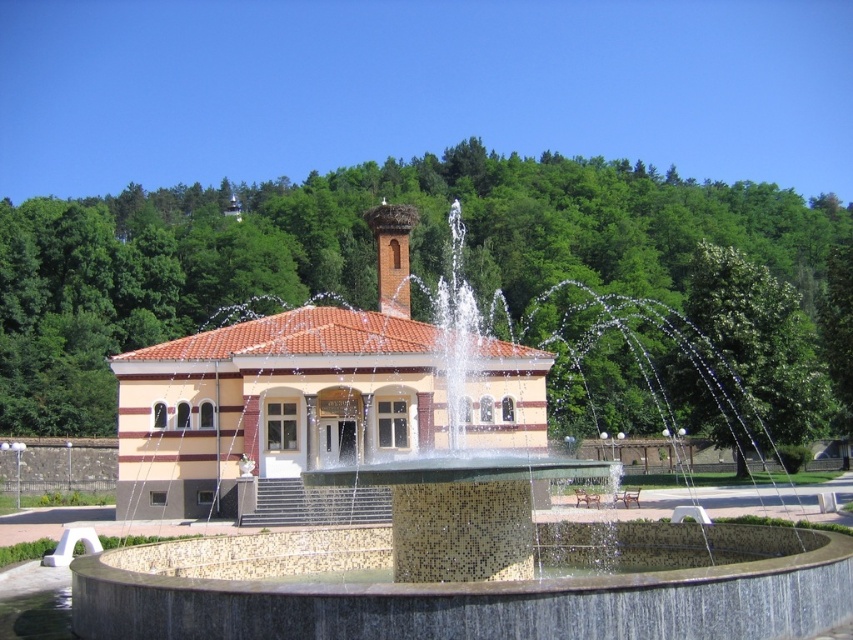
Question: Which object is the closest to the mosaic tiled fountain at center?

Choices:
 (A) yellow brick building at center
 (B) brick chimney at center

Answer: (A)

Question: Which point is closer to the camera?

Choices:
 (A) (241, 550)
 (B) (225, 413)
 (C) (397, 208)

Answer: (A)

Question: Can you confirm if mosaic tiled fountain at center is wider than yellow brick building at center?

Choices:
 (A) yes
 (B) no

Answer: (B)

Question: Which of these objects is positioned farthest from the mosaic tiled fountain at center?

Choices:
 (A) brick chimney at center
 (B) yellow brick building at center

Answer: (A)

Question: In this image, where is yellow brick building at center located relative to brick chimney at center?

Choices:
 (A) right
 (B) left

Answer: (B)

Question: Does yellow brick building at center lie behind brick chimney at center?

Choices:
 (A) no
 (B) yes

Answer: (A)